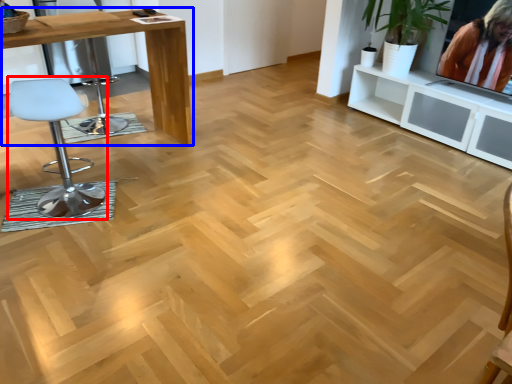
Question: Which of the following is the closest to the observer, chair (highlighted by a red box) or table (highlighted by a blue box)?

Choices:
 (A) chair
 (B) table

Answer: (A)